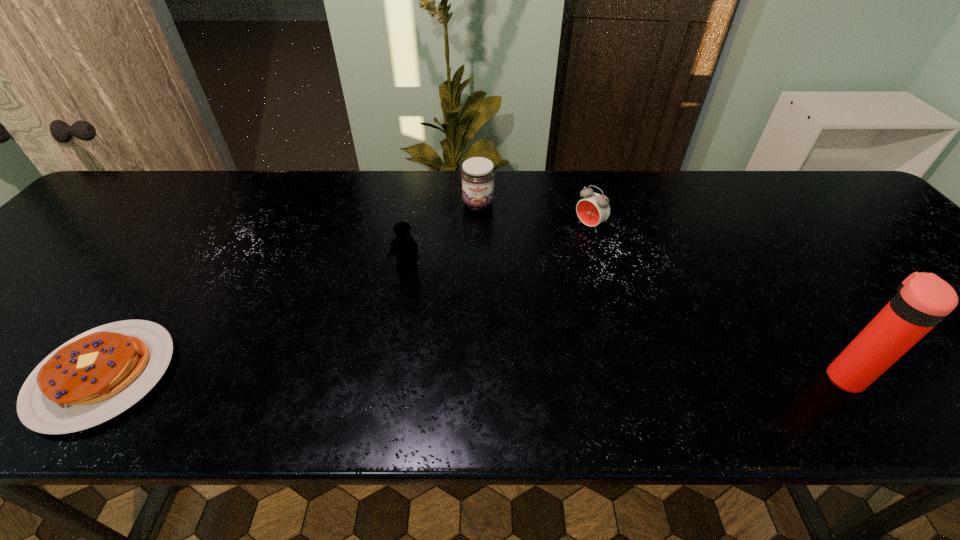
You are a GUI agent. You are given a task and a screenshot of the screen. Output one action in this format:
    pyautogui.click(x=<x>, y=<y>)
    Task: Click on the object at the near edge
    The image size is (960, 540).
    Given the screenshot: What is the action you would take?
    pyautogui.click(x=923, y=300)

At what (x,y) coordinates should I click in order to perform the action: click on vacant space at the far edge of the desktop. Please return your answer as a coordinate pair (x, y). Image resolution: width=960 pixels, height=540 pixels. Looking at the image, I should click on (560, 206).

At what (x,y) coordinates should I click in order to perform the action: click on free space at the near edge of the desktop. Please return your answer as a coordinate pair (x, y). This screenshot has height=540, width=960. Looking at the image, I should click on (521, 343).

This screenshot has height=540, width=960. I want to click on blank area at the left edge, so click(62, 260).

Image resolution: width=960 pixels, height=540 pixels. In the image, there is a desktop. What are the coordinates of `vacant space at the far left corner` in the screenshot? It's located at (165, 188).

Find the location of a particular element. This screenshot has width=960, height=540. vacant space at the far right corner of the desktop is located at coordinates (811, 180).

This screenshot has height=540, width=960. Identify the location of free point between the Lego and the rightmost object. (625, 321).

Locate an element on the screen. The width and height of the screenshot is (960, 540). free area in between the Lego and the thermos bottle is located at coordinates (625, 321).

You are a GUI agent. You are given a task and a screenshot of the screen. Output one action in this format:
    pyautogui.click(x=<x>, y=<y>)
    Task: Click on the unoccupied position between the tallest object and the farthest object
    Image resolution: width=960 pixels, height=540 pixels.
    Given the screenshot: What is the action you would take?
    pyautogui.click(x=660, y=290)

Where is `blank region between the jam and the second object from left to right`? This screenshot has height=540, width=960. blank region between the jam and the second object from left to right is located at coordinates (443, 235).